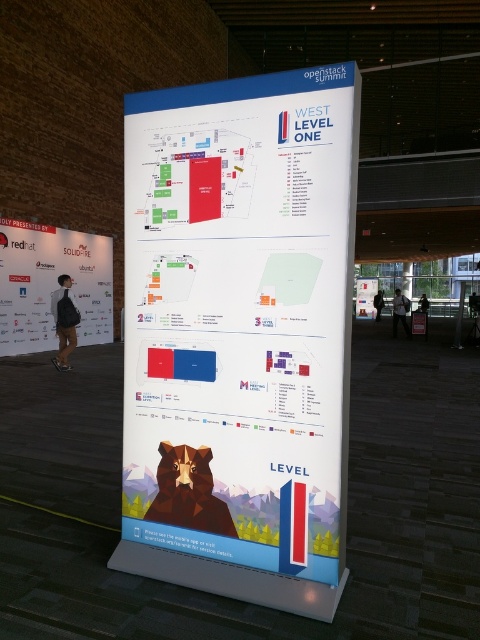
Is white matte banner at left to the right of white glossy poster at center from the viewer's perspective?

Incorrect, white matte banner at left is not on the right side of white glossy poster at center.

From the picture: Is white matte banner at left bigger than white glossy poster at center?

Incorrect, white matte banner at left is not larger than white glossy poster at center.

Describe the element at coordinates (51, 284) in the screenshot. I see `white matte banner at left` at that location.

At what (x,y) coordinates should I click in order to perform the action: click on white matte banner at left. Please return your answer as a coordinate pair (x, y). Looking at the image, I should click on tap(51, 284).

Can you confirm if white paper at center is positioned above white matte banner at left?

No, white paper at center is not above white matte banner at left.

Between white paper at center and white matte banner at left, which one has less height?

white paper at center

You are a GUI agent. You are given a task and a screenshot of the screen. Output one action in this format:
    pyautogui.click(x=<x>, y=<y>)
    Task: Click on the white paper at center
    The image size is (480, 640).
    Given the screenshot: What is the action you would take?
    pyautogui.click(x=240, y=317)

Can you confirm if white paper at center is positioned below white glossy poster at center?

Yes.

Can you confirm if white paper at center is taller than white glossy poster at center?

No, white paper at center is not taller than white glossy poster at center.

In order to click on white paper at center in this screenshot , I will do `click(240, 317)`.

Where is `white paper at center`? The height and width of the screenshot is (640, 480). white paper at center is located at coordinates (240, 317).